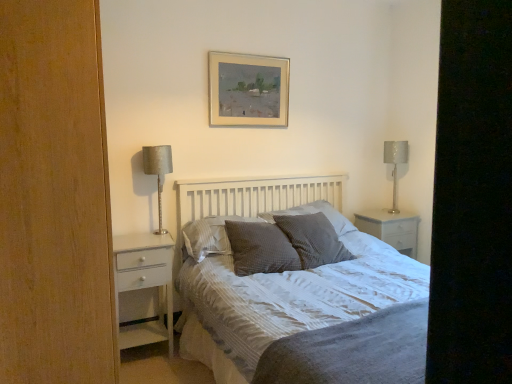
Question: In which direction should I rotate to look at gray textured pillow at center, the 3th pillow viewed from the right?

Choices:
 (A) left
 (B) right

Answer: (B)

Question: Is waffle-textured gray pillow at center, placed as the 3th pillow when sorted from left to right, smaller than black matte screen door at right?

Choices:
 (A) yes
 (B) no

Answer: (A)

Question: Is waffle-textured gray pillow at center, placed as the 3th pillow when sorted from left to right, oriented away from black matte screen door at right?

Choices:
 (A) no
 (B) yes

Answer: (A)

Question: Does waffle-textured gray pillow at center, placed as the second pillow when sorted from right to left, have a lesser width compared to black matte screen door at right?

Choices:
 (A) yes
 (B) no

Answer: (B)

Question: From a real-world perspective, is waffle-textured gray pillow at center, placed as the second pillow when sorted from right to left, below black matte screen door at right?

Choices:
 (A) no
 (B) yes

Answer: (B)

Question: Is waffle-textured gray pillow at center, placed as the second pillow when sorted from right to left, shorter than black matte screen door at right?

Choices:
 (A) yes
 (B) no

Answer: (A)

Question: From a real-world perspective, does waffle-textured gray pillow at center, placed as the second pillow when sorted from right to left, stand above black matte screen door at right?

Choices:
 (A) no
 (B) yes

Answer: (A)

Question: Considering the relative sizes of gray textured pillow at center, the fourth pillow from the right, and silver metallic picture frame at upper center in the image provided, is gray textured pillow at center, the fourth pillow from the right, thinner than silver metallic picture frame at upper center?

Choices:
 (A) no
 (B) yes

Answer: (A)

Question: From a real-world perspective, is gray textured pillow at center, the fourth pillow from the right, below silver metallic picture frame at upper center?

Choices:
 (A) yes
 (B) no

Answer: (A)

Question: Considering the relative sizes of gray textured pillow at center, the first pillow viewed from the left, and silver metallic picture frame at upper center in the image provided, is gray textured pillow at center, the first pillow viewed from the left, wider than silver metallic picture frame at upper center?

Choices:
 (A) yes
 (B) no

Answer: (A)

Question: From the image's perspective, would you say gray textured pillow at center, the fourth pillow from the right, is shown under silver metallic picture frame at upper center?

Choices:
 (A) yes
 (B) no

Answer: (A)

Question: From a real-world perspective, is gray textured pillow at center, the fourth pillow from the right, physically above silver metallic picture frame at upper center?

Choices:
 (A) yes
 (B) no

Answer: (B)

Question: Is gray textured pillow at center, the first pillow viewed from the left, aimed at silver metallic picture frame at upper center?

Choices:
 (A) yes
 (B) no

Answer: (B)

Question: Considering the relative sizes of gray textured pillow at center, the fourth pillow from the right, and gray textured pillow at center, the 3th pillow viewed from the right, in the image provided, is gray textured pillow at center, the fourth pillow from the right, thinner than gray textured pillow at center, the 3th pillow viewed from the right,?

Choices:
 (A) no
 (B) yes

Answer: (B)